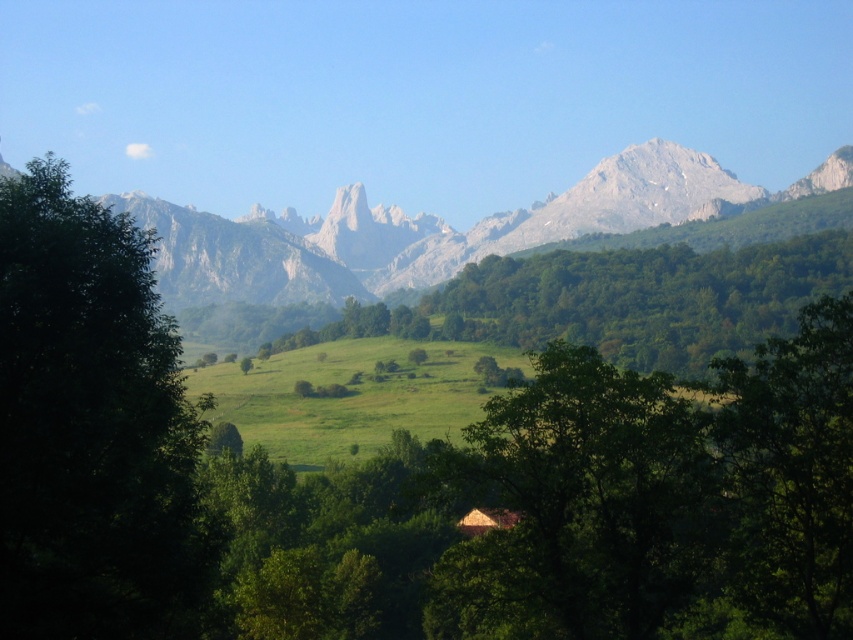
Who is positioned more to the left, green leafy tree at left or rocky gray mountain range at center?

Positioned to the left is green leafy tree at left.

Is green leafy tree at left to the left of rocky gray mountain range at center from the viewer's perspective?

Correct, you'll find green leafy tree at left to the left of rocky gray mountain range at center.

Does point (178, 552) come behind point (376, 260)?

No, (178, 552) is in front of (376, 260).

Where is `green leafy tree at left`? green leafy tree at left is located at coordinates (91, 428).